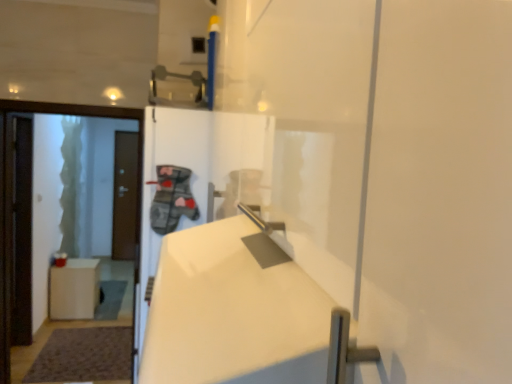
Question: In terms of height, does brown matte door at left, the first door positioned from the left, look taller or shorter compared to white matte trash can at lower left?

Choices:
 (A) short
 (B) tall

Answer: (B)

Question: Considering the positions of point (116, 210) and point (93, 284), is point (116, 210) closer or farther from the camera than point (93, 284)?

Choices:
 (A) closer
 (B) farther

Answer: (B)

Question: Which of these objects is positioned closest to the white glossy door at left, the 2th door positioned from the back?

Choices:
 (A) brown matte door at left, which appears as the 2th door when viewed from the front
 (B) metallic gray door handle at upper center
 (C) white matte trash can at lower left

Answer: (B)

Question: Estimate the real-world distances between objects in this image. Which object is farther from the brown matte door at left, which is the first door from back to front?

Choices:
 (A) white glossy door at left, arranged as the second door when viewed from the left
 (B) white matte trash can at lower left
 (C) metallic gray door handle at upper center

Answer: (C)